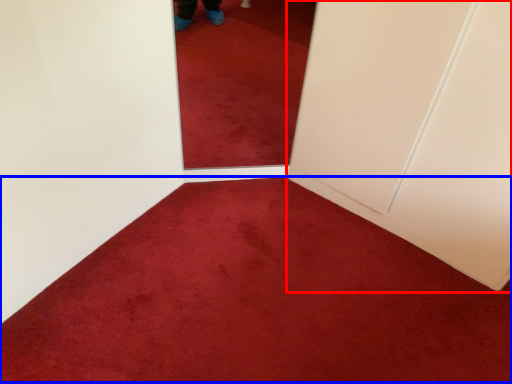
Question: Which object is further to the camera taking this photo, door (highlighted by a red box) or plain (highlighted by a blue box)?

Choices:
 (A) door
 (B) plain

Answer: (A)